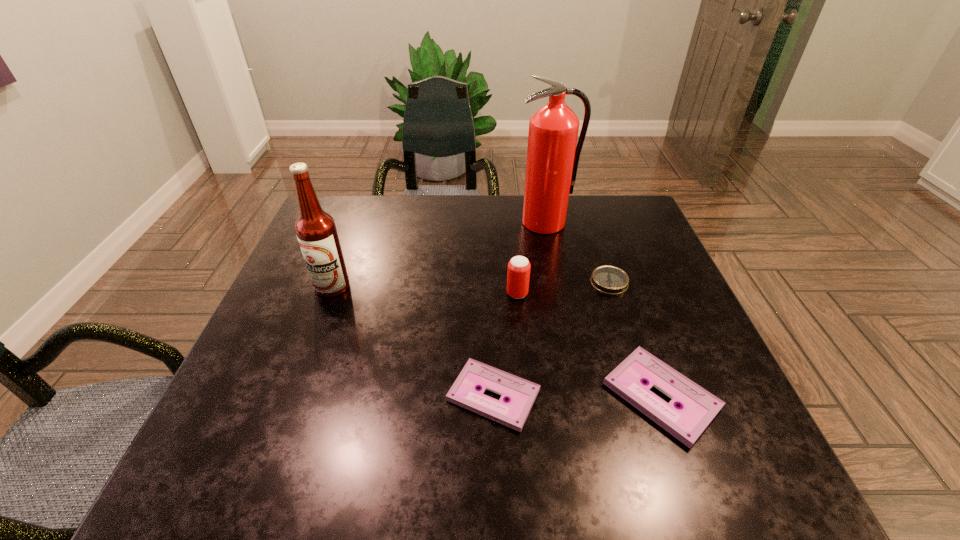
Find the location of a particular element. Image resolution: width=960 pixels, height=540 pixels. the shorter videotape is located at coordinates (520, 393).

Identify the location of the right videotape. (x=697, y=408).

Find the location of a particular element. alcohol is located at coordinates (316, 232).

The image size is (960, 540). I want to click on the leftmost object, so click(x=316, y=232).

This screenshot has width=960, height=540. What are the coordinates of `the farthest object` in the screenshot? It's located at (552, 155).

You are a GUI agent. You are given a task and a screenshot of the screen. Output one action in this format:
    pyautogui.click(x=<x>, y=<y>)
    Task: Click on the tallest object
    
    Given the screenshot: What is the action you would take?
    pyautogui.click(x=552, y=155)

The width and height of the screenshot is (960, 540). What are the coordinates of `compass` in the screenshot? It's located at (612, 280).

Locate an element on the screen. The height and width of the screenshot is (540, 960). beer can is located at coordinates (518, 275).

Where is `free location located 0.050m on the right of the left videotape`? free location located 0.050m on the right of the left videotape is located at coordinates (566, 395).

Identify the location of free region located 0.180m on the back of the right videotape. (624, 293).